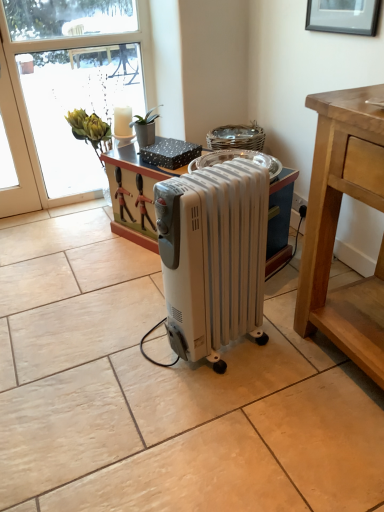
Question: Is black matte picture frame at upper center bigger or smaller than transparent glass window at upper left?

Choices:
 (A) big
 (B) small

Answer: (B)

Question: Is point (374, 33) closer or farther from the camera than point (21, 143)?

Choices:
 (A) closer
 (B) farther

Answer: (A)

Question: Which object is the closest to the transparent glass window at upper left?

Choices:
 (A) white plastic radiator at center
 (B) black matte picture frame at upper center

Answer: (B)

Question: Which is farther from the black matte picture frame at upper center?

Choices:
 (A) transparent glass window at upper left
 (B) white plastic radiator at center

Answer: (A)